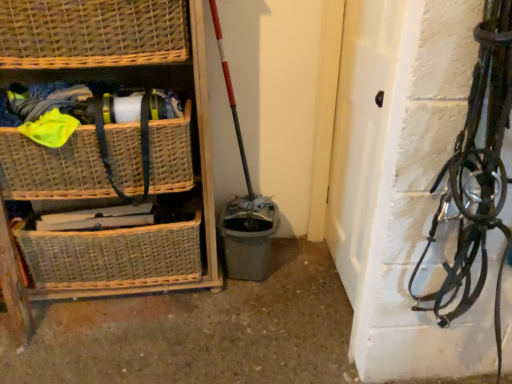
Looking at this image, what is the approximate height of white matte door at center?

white matte door at center is 3.72 feet tall.

Locate an element on the screen. The image size is (512, 384). white matte door at center is located at coordinates (361, 139).

Where is `white matte door at center`? This screenshot has height=384, width=512. white matte door at center is located at coordinates [x=361, y=139].

Is woven wicker basket at upper left, the 3th basket from the bottom, at the back of woven wicker basket at left, the second basket positioned from the top?

No, woven wicker basket at left, the second basket positioned from the top, is not facing the opposite direction of woven wicker basket at upper left, the 3th basket from the bottom.

Is woven wicker basket at upper left, the 3th basket from the bottom, a part of woven wicker basket at left, the second basket from the bottom?

No, woven wicker basket at left, the second basket from the bottom, does not contain woven wicker basket at upper left, the 3th basket from the bottom.

How many degrees apart are the facing directions of woven wicker basket at left, the second basket positioned from the top, and woven wicker basket at upper left, the 3th basket from the bottom?

0.000373 degrees separate the facing orientations of woven wicker basket at left, the second basket positioned from the top, and woven wicker basket at upper left, the 3th basket from the bottom.

Which is farther, (96, 177) or (42, 41)?

The point (96, 177) is farther.

Can you confirm if woven wicker basket at left, the second basket positioned from the top, is positioned to the right of woven wicker basket at lower left, positioned as the 3th basket in top-to-bottom order?

Indeed, woven wicker basket at left, the second basket positioned from the top, is positioned on the right side of woven wicker basket at lower left, positioned as the 3th basket in top-to-bottom order.

From the image's perspective, which object appears higher, woven wicker basket at left, the second basket from the bottom, or woven wicker basket at lower left, which appears as the first basket when ordered from the bottom?

woven wicker basket at left, the second basket from the bottom, from the image's perspective.

Is woven wicker basket at left, the second basket from the bottom, positioned far away from woven wicker basket at lower left, positioned as the 3th basket in top-to-bottom order?

No, there isn't a large distance between woven wicker basket at left, the second basket from the bottom, and woven wicker basket at lower left, positioned as the 3th basket in top-to-bottom order.

How different are the orientations of woven wicker basket at left, the second basket from the bottom, and woven wicker basket at lower left, which appears as the first basket when ordered from the bottom, in degrees?

The angle between the facing direction of woven wicker basket at left, the second basket from the bottom, and the facing direction of woven wicker basket at lower left, which appears as the first basket when ordered from the bottom, is 0.000649 degrees.

Is there a large distance between woven wicker basket at lower left, positioned as the 3th basket in top-to-bottom order, and woven wicker basket at left?

No.

Consider the image. Considering the positions of objects woven wicker basket at lower left, which appears as the first basket when ordered from the bottom, and woven wicker basket at left in the image provided, who is behind, woven wicker basket at lower left, which appears as the first basket when ordered from the bottom, or woven wicker basket at left?

woven wicker basket at lower left, which appears as the first basket when ordered from the bottom, is further from the camera.

Does woven wicker basket at lower left, which appears as the first basket when ordered from the bottom, have a smaller size compared to woven wicker basket at left?

Indeed, woven wicker basket at lower left, which appears as the first basket when ordered from the bottom, has a smaller size compared to woven wicker basket at left.

Does woven wicker basket at lower left, which appears as the first basket when ordered from the bottom, have a greater width compared to woven wicker basket at left?

Incorrect, the width of woven wicker basket at lower left, which appears as the first basket when ordered from the bottom, does not surpass that of woven wicker basket at left.

Can you tell me how much white matte door at center and woven wicker basket at lower left, positioned as the 3th basket in top-to-bottom order, differ in facing direction?

The facing directions of white matte door at center and woven wicker basket at lower left, positioned as the 3th basket in top-to-bottom order, are 91.8 degrees apart.

From a real-world perspective, is white matte door at center physically above woven wicker basket at lower left, which appears as the first basket when ordered from the bottom?

Yes, from a real-world perspective, white matte door at center is over woven wicker basket at lower left, which appears as the first basket when ordered from the bottom

In terms of height, does white matte door at center look taller or shorter compared to woven wicker basket at lower left, positioned as the 3th basket in top-to-bottom order?

white matte door at center is taller than woven wicker basket at lower left, positioned as the 3th basket in top-to-bottom order.

Between point (392, 65) and point (16, 239), which one is positioned in front?

Positioned in front is point (392, 65).

Between woven wicker basket at left and woven wicker basket at upper left, placed as the 1th basket when sorted from top to bottom, which one has larger size?

Bigger between the two is woven wicker basket at left.

From the image's perspective, between woven wicker basket at left and woven wicker basket at upper left, placed as the 1th basket when sorted from top to bottom, who is located below?

woven wicker basket at left appears lower in the image.

Considering the positions of points (30, 154) and (102, 60), is point (30, 154) farther from camera compared to point (102, 60)?

Yes, it is behind point (102, 60).

What's the angular difference between woven wicker basket at left and woven wicker basket at upper left, the 3th basket from the bottom,'s facing directions?

0.00132 degrees.

Is woven wicker basket at lower left, which appears as the first basket when ordered from the bottom, at the left side of woven wicker basket at left, the second basket positioned from the top?

Correct, you'll find woven wicker basket at lower left, which appears as the first basket when ordered from the bottom, to the left of woven wicker basket at left, the second basket positioned from the top.

Is woven wicker basket at left, the second basket from the bottom, completely or partially inside woven wicker basket at lower left, positioned as the 3th basket in top-to-bottom order?

That's incorrect, woven wicker basket at left, the second basket from the bottom, is not inside woven wicker basket at lower left, positioned as the 3th basket in top-to-bottom order.

From a real-world perspective, is woven wicker basket at lower left, positioned as the 3th basket in top-to-bottom order, positioned above or below woven wicker basket at left, the second basket positioned from the top?

woven wicker basket at lower left, positioned as the 3th basket in top-to-bottom order, is situated lower than woven wicker basket at left, the second basket positioned from the top, in the real world.

Locate an element on the screen. basket that appears below the woven wicker basket at left (from a real-world perspective) is located at coordinates (112, 255).

From a real-world perspective, relative to woven wicker basket at lower left, which appears as the first basket when ordered from the bottom, is woven wicker basket at left vertically above or below?

woven wicker basket at left is situated higher than woven wicker basket at lower left, which appears as the first basket when ordered from the bottom, in the real world.

Between woven wicker basket at left and woven wicker basket at lower left, positioned as the 3th basket in top-to-bottom order, which one has more height?

Standing taller between the two is woven wicker basket at left.

At what (x,y) coordinates should I click in order to perform the action: click on the 1st basket directly beneath the woven wicker basket at upper left, the 3th basket from the bottom (from a real-world perspective). Please return your answer as a coordinate pair (x, y). The height and width of the screenshot is (384, 512). Looking at the image, I should click on (52, 168).

At what (x,y) coordinates should I click in order to perform the action: click on basket on the left of woven wicker basket at left, the second basket positioned from the top. Please return your answer as a coordinate pair (x, y). Looking at the image, I should click on (112, 255).

Which object lies further to the anchor point woven wicker basket at left, woven wicker basket at left, the second basket from the bottom, or woven wicker basket at upper left, the 3th basket from the bottom?

woven wicker basket at upper left, the 3th basket from the bottom, lies further to woven wicker basket at left than the other object.

From the image, which object appears to be farther from woven wicker basket at left, woven wicker basket at upper left, placed as the 1th basket when sorted from top to bottom, or woven wicker basket at lower left, positioned as the 3th basket in top-to-bottom order?

woven wicker basket at upper left, placed as the 1th basket when sorted from top to bottom, lies further to woven wicker basket at left than the other object.

Looking at this image, when comparing their distances from woven wicker basket at left, the second basket positioned from the top, does woven wicker basket at left or white matte door at center seem closer?

woven wicker basket at left is positioned closer to the anchor woven wicker basket at left, the second basket positioned from the top.

Looking at this image, looking at the image, which one is located further to white matte door at center, woven wicker basket at lower left, which appears as the first basket when ordered from the bottom, or woven wicker basket at upper left, the 3th basket from the bottom?

woven wicker basket at lower left, which appears as the first basket when ordered from the bottom, lies further to white matte door at center than the other object.

Looking at the image, which one is located further to woven wicker basket at left, woven wicker basket at left, the second basket positioned from the top, or woven wicker basket at lower left, which appears as the first basket when ordered from the bottom?

Based on the image, woven wicker basket at lower left, which appears as the first basket when ordered from the bottom, appears to be further to woven wicker basket at left.

From the image, which object appears to be nearer to woven wicker basket at upper left, placed as the 1th basket when sorted from top to bottom, woven wicker basket at lower left, positioned as the 3th basket in top-to-bottom order, or woven wicker basket at left, the second basket positioned from the top?

The object closer to woven wicker basket at upper left, placed as the 1th basket when sorted from top to bottom, is woven wicker basket at left, the second basket positioned from the top.

When comparing their distances from white matte door at center, does woven wicker basket at left, the second basket from the bottom, or woven wicker basket at upper left, placed as the 1th basket when sorted from top to bottom, seem closer?

woven wicker basket at left, the second basket from the bottom, lies closer to white matte door at center than the other object.

Considering their positions, is woven wicker basket at left positioned further to woven wicker basket at left, the second basket positioned from the top, than woven wicker basket at lower left, which appears as the first basket when ordered from the bottom?

The object further to woven wicker basket at left, the second basket positioned from the top, is woven wicker basket at lower left, which appears as the first basket when ordered from the bottom.

Where is `basket between woven wicker basket at upper left, placed as the 1th basket when sorted from top to bottom, and woven wicker basket at left, in the vertical direction`? This screenshot has height=384, width=512. basket between woven wicker basket at upper left, placed as the 1th basket when sorted from top to bottom, and woven wicker basket at left, in the vertical direction is located at coordinates (x=52, y=168).

At what (x,y) coordinates should I click in order to perform the action: click on shelf between woven wicker basket at upper left, placed as the 1th basket when sorted from top to bottom, and woven wicker basket at lower left, positioned as the 3th basket in top-to-bottom order, vertically. Please return your answer as a coordinate pair (x, y). This screenshot has height=384, width=512. Looking at the image, I should click on (106, 231).

Locate an element on the screen. The height and width of the screenshot is (384, 512). basket between woven wicker basket at upper left, placed as the 1th basket when sorted from top to bottom, and woven wicker basket at lower left, which appears as the first basket when ordered from the bottom, from top to bottom is located at coordinates (52, 168).

The image size is (512, 384). Identify the location of basket situated between woven wicker basket at left, the second basket positioned from the top, and white matte door at center from left to right. click(92, 33).